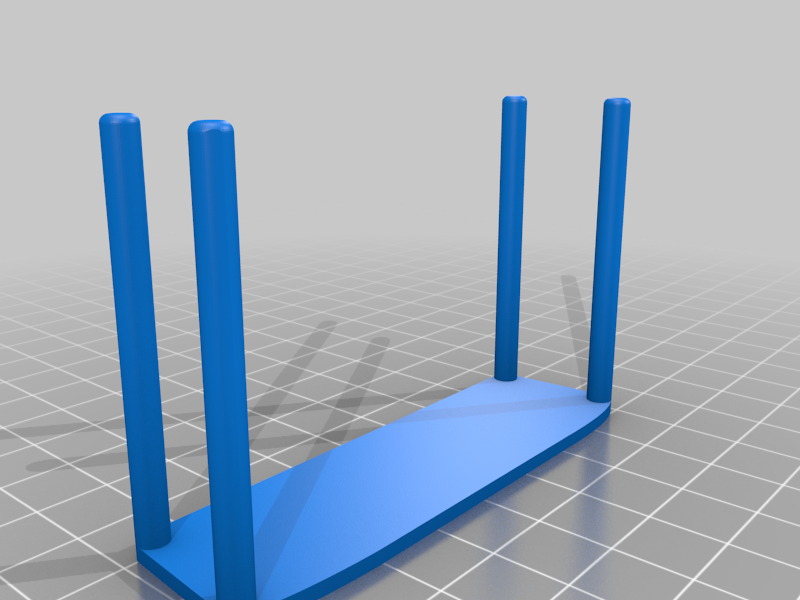
Identify the location of table. click(x=485, y=456).